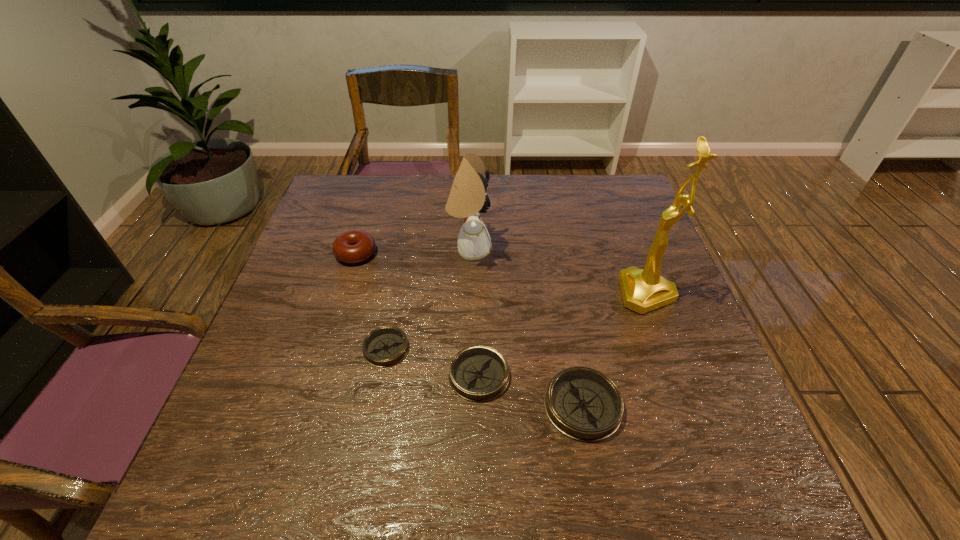
Identify the location of object located at the right edge. (643, 290).

Locate an element on the screen. This screenshot has height=540, width=960. free space at the far edge is located at coordinates (543, 179).

The width and height of the screenshot is (960, 540). Find the location of `vacant space at the left edge of the desktop`. vacant space at the left edge of the desktop is located at coordinates (311, 362).

What are the coordinates of `vacant space at the right edge of the desktop` in the screenshot? It's located at (692, 361).

What are the coordinates of `vacant area at the far left corner` in the screenshot? It's located at (344, 177).

The image size is (960, 540). Identify the location of free region at the near left corner of the desktop. (292, 415).

Identify the location of vacant region at the far right corner of the desktop. This screenshot has height=540, width=960. pos(623,178).

I want to click on vacant space at the near right corner of the desktop, so click(729, 437).

You are a GUI agent. You are given a task and a screenshot of the screen. Output one action in this format:
    pyautogui.click(x=<x>, y=<y>)
    Task: Click on the vacant region between the doll and the second compass from right to left
    
    Given the screenshot: What is the action you would take?
    pyautogui.click(x=474, y=313)

I want to click on vacant point located between the second object from left to right and the fifth shortest object, so click(428, 299).